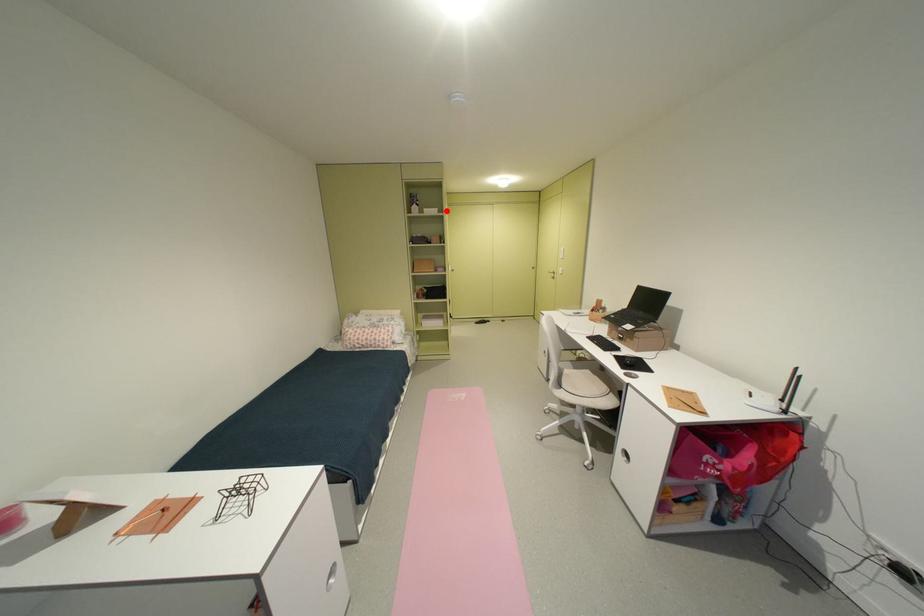
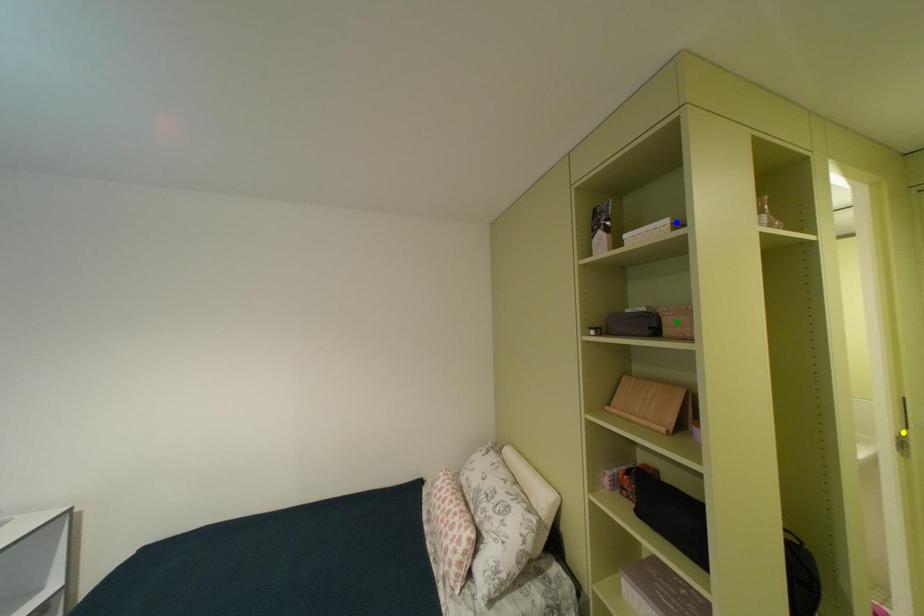
Question: I am providing you with two images of the same scene from different viewpoints. A red point is marked on the first image. You are given multiple points on the second image. Can you choose the point in image 2 that corresponds to the point in image 1?

Choices:
 (A) yellow point
 (B) green point
 (C) blue point

Answer: (C)